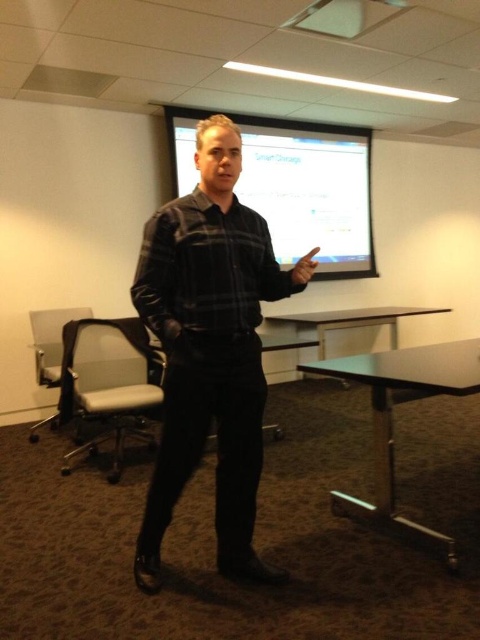
Question: Is black metal table at lower center wider than white plastic projector at upper center?

Choices:
 (A) yes
 (B) no

Answer: (A)

Question: Which of these objects is positioned closest to the black metal table at lower center?

Choices:
 (A) black plaid shirt at center
 (B) gray fabric swivel chair at left

Answer: (A)

Question: Which point is closer to the camera?

Choices:
 (A) gray fabric swivel chair at left
 (B) white plastic projector at upper center
 (C) white glossy table at lower center

Answer: (B)

Question: Does black plaid shirt at center appear under white glossy table at lower center?

Choices:
 (A) yes
 (B) no

Answer: (A)

Question: Which object is the farthest from the gray fabric swivel chair at left?

Choices:
 (A) white glossy table at lower center
 (B) white glossy projection screen at upper center

Answer: (B)

Question: Observing the image, what is the correct spatial positioning of black plaid shirt at center in reference to white glossy projection screen at upper center?

Choices:
 (A) left
 (B) right

Answer: (A)